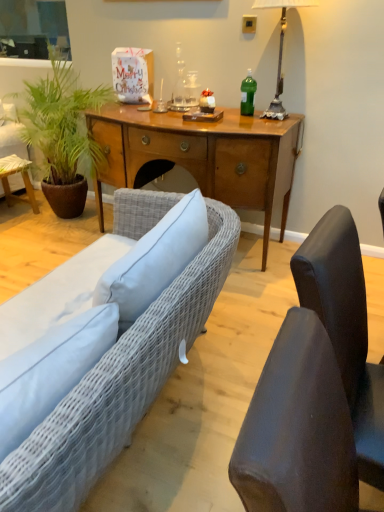
Question: From a real-world perspective, does green leafy plant at left sit lower than metallic silver lamp at upper right?

Choices:
 (A) yes
 (B) no

Answer: (A)

Question: Can you confirm if green leafy plant at left is wider than metallic silver lamp at upper right?

Choices:
 (A) no
 (B) yes

Answer: (B)

Question: Is green leafy plant at left to the left of metallic silver lamp at upper right from the viewer's perspective?

Choices:
 (A) yes
 (B) no

Answer: (A)

Question: Is green leafy plant at left located outside metallic silver lamp at upper right?

Choices:
 (A) yes
 (B) no

Answer: (A)

Question: Can you confirm if green leafy plant at left is bigger than metallic silver lamp at upper right?

Choices:
 (A) yes
 (B) no

Answer: (A)

Question: In the image, is wooden desk at center on the left side or the right side of dark gray fabric chair at right, which appears as the 1th chair when viewed from the back?

Choices:
 (A) right
 (B) left

Answer: (B)

Question: Choose the correct answer: Is wooden desk at center inside dark gray fabric chair at right, which appears as the 1th chair when viewed from the back, or outside it?

Choices:
 (A) outside
 (B) inside

Answer: (A)

Question: From the image's perspective, is wooden desk at center located above or below dark gray fabric chair at right, which appears as the 1th chair when viewed from the back?

Choices:
 (A) above
 (B) below

Answer: (A)

Question: Is wooden desk at center wider or thinner than dark gray fabric chair at right, which appears as the 1th chair when viewed from the back?

Choices:
 (A) thin
 (B) wide

Answer: (B)

Question: Is woven fabric couch at lower left in front of or behind green plastic bottle at center in the image?

Choices:
 (A) behind
 (B) front

Answer: (B)

Question: From the image's perspective, is woven fabric couch at lower left above or below green plastic bottle at center?

Choices:
 (A) below
 (B) above

Answer: (A)

Question: Choose the correct answer: Is woven fabric couch at lower left inside green plastic bottle at center or outside it?

Choices:
 (A) outside
 (B) inside

Answer: (A)

Question: Considering the positions of woven fabric couch at lower left and green plastic bottle at center in the image, is woven fabric couch at lower left taller or shorter than green plastic bottle at center?

Choices:
 (A) tall
 (B) short

Answer: (B)

Question: Relative to green leafy plant at left, is wooden desk at center in front or behind?

Choices:
 (A) front
 (B) behind

Answer: (A)

Question: Which is correct: wooden desk at center is inside green leafy plant at left, or outside of it?

Choices:
 (A) inside
 (B) outside

Answer: (B)